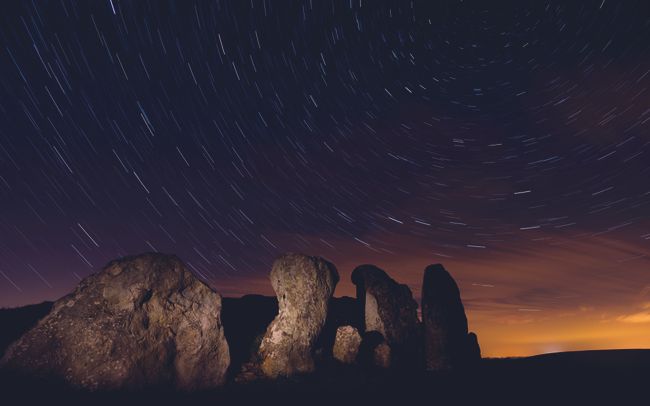
The height and width of the screenshot is (406, 650). What are the coordinates of `light` in the screenshot? It's located at (304, 301).